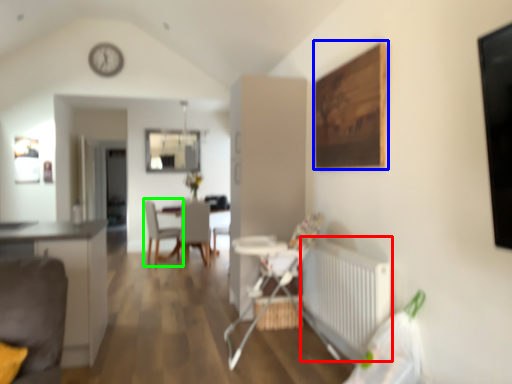
Question: Which is farther away from radiator (highlighted by a red box)? picture frame (highlighted by a blue box) or chair (highlighted by a green box)?

Choices:
 (A) picture frame
 (B) chair

Answer: (B)